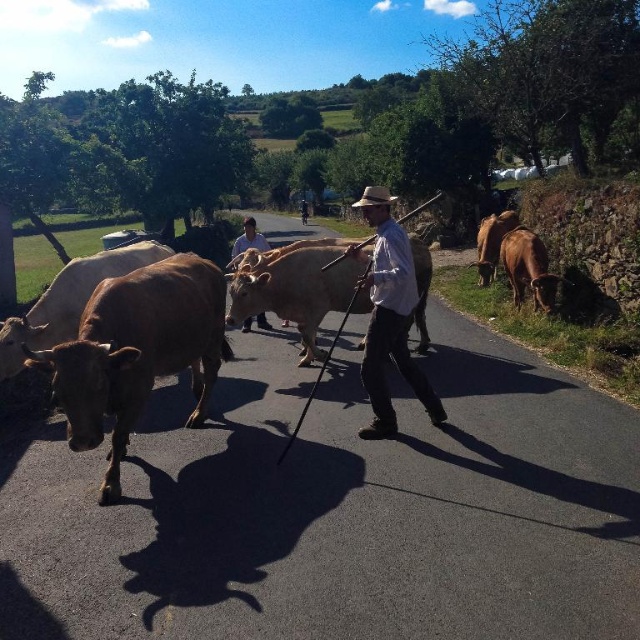
Question: Is brown matte bull at right positioned before brown felt cowboy hat at center?

Choices:
 (A) no
 (B) yes

Answer: (A)

Question: Can you confirm if brown glossy bull at right is positioned above brown felt cowboy hat at center?

Choices:
 (A) no
 (B) yes

Answer: (A)

Question: Based on their relative distances, which object is farther from the white shirt at center?

Choices:
 (A) brown matte bull at right
 (B) light brown cotton shirt at center
 (C) brown matte cow at left
 (D) brown glossy bull at right

Answer: (D)

Question: Which point is farther to the camera?

Choices:
 (A) (388, 189)
 (B) (406, 253)
 (C) (492, 237)
 (D) (180, 257)

Answer: (A)

Question: Is brown matte cow at left to the right of brown matte bull at right from the viewer's perspective?

Choices:
 (A) no
 (B) yes

Answer: (A)

Question: Based on their relative distances, which object is farther from the brown matte cow at left?

Choices:
 (A) brown felt cowboy hat at center
 (B) brown matte bull at right

Answer: (B)